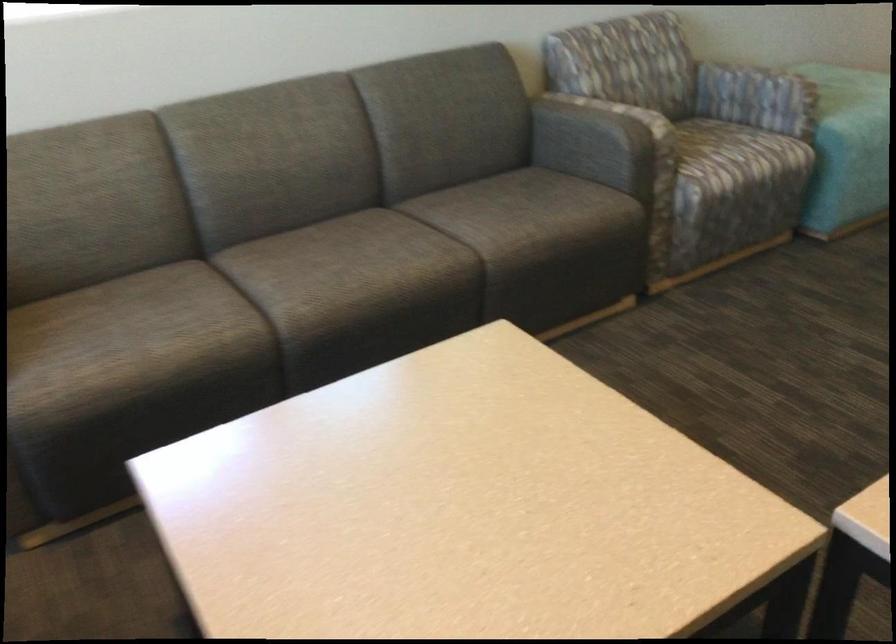
Find the location of a particular element. teal chair sitting surface is located at coordinates (854, 129).